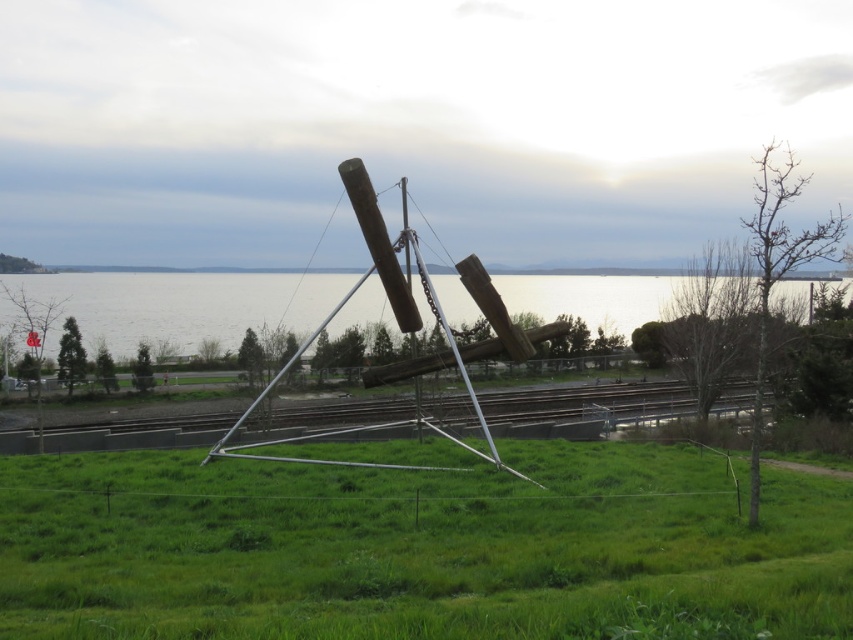
Question: Is green grass at center below transparent water at center?

Choices:
 (A) yes
 (B) no

Answer: (A)

Question: Can you confirm if green grass at center is bigger than transparent water at center?

Choices:
 (A) yes
 (B) no

Answer: (B)

Question: Is green grass at center wider than transparent water at center?

Choices:
 (A) no
 (B) yes

Answer: (A)

Question: Among these points, which one is nearest to the camera?

Choices:
 (A) (404, 486)
 (B) (271, 291)

Answer: (A)

Question: Which point is closer to the camera?

Choices:
 (A) transparent water at center
 (B) green grass at center

Answer: (B)